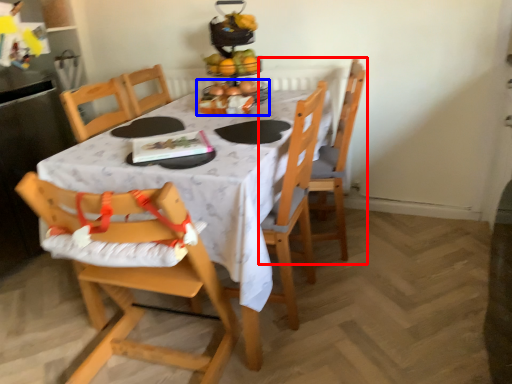
Question: Which of the following is the farthest to the observer, chair (highlighted by a red box) or tableware (highlighted by a blue box)?

Choices:
 (A) chair
 (B) tableware

Answer: (B)